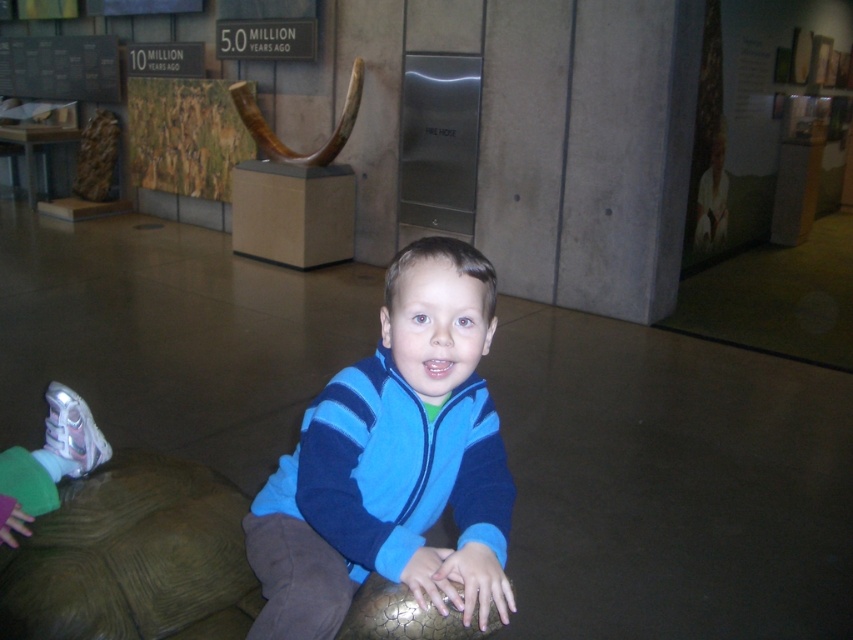
The width and height of the screenshot is (853, 640). What do you see at coordinates (393, 461) in the screenshot?
I see `blue fleece jacket at center` at bounding box center [393, 461].

Is blue fleece jacket at center bigger than brown textured tortoise at lower left?

Correct, blue fleece jacket at center is larger in size than brown textured tortoise at lower left.

Find the location of `blue fleece jacket at center`. blue fleece jacket at center is located at coordinates (393, 461).

What are the coordinates of `blue fleece jacket at center` in the screenshot? It's located at (393, 461).